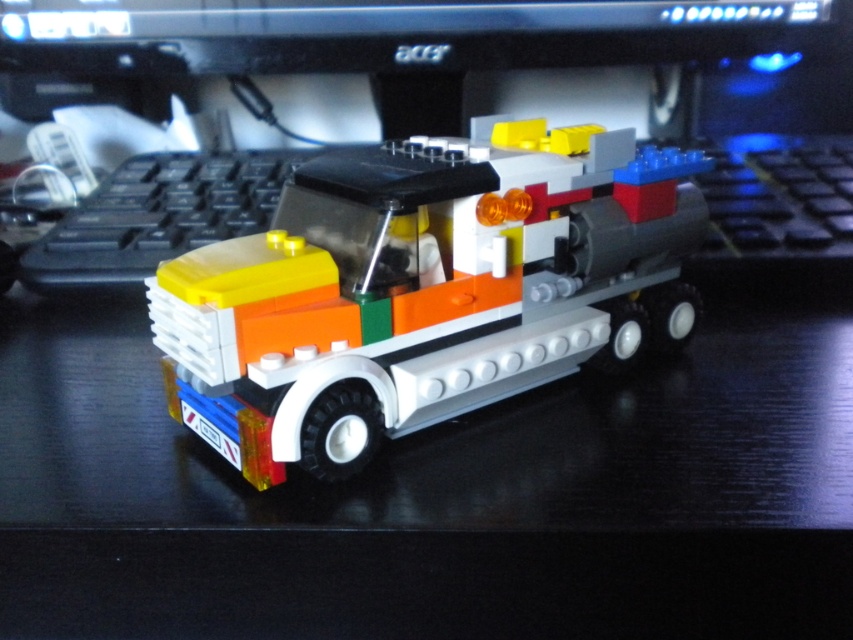
Is translucent orange lego truck at center positioned behind black plastic computer monitor at upper center?

No, it is not.

The height and width of the screenshot is (640, 853). What are the coordinates of `translucent orange lego truck at center` in the screenshot? It's located at (426, 289).

Locate an element on the screen. The image size is (853, 640). translucent orange lego truck at center is located at coordinates (426, 289).